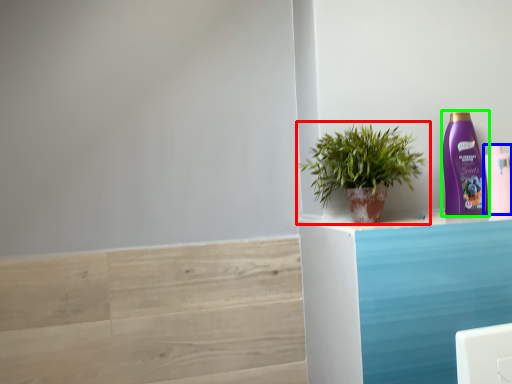
Question: Which object is the farthest from houseplant (highlighted by a red box)? Choose among these: bottle (highlighted by a blue box) or bottle (highlighted by a green box).

Choices:
 (A) bottle
 (B) bottle

Answer: (A)